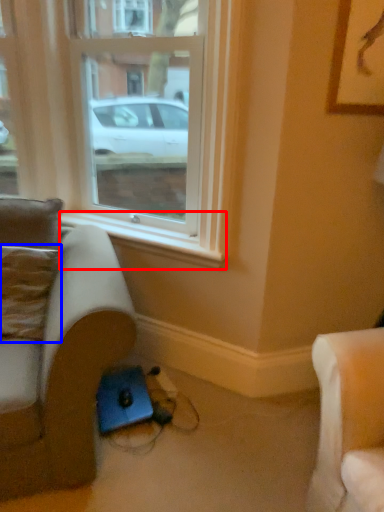
Question: Among these objects, which one is nearest to the camera, window sill (highlighted by a red box) or pillow (highlighted by a blue box)?

Choices:
 (A) window sill
 (B) pillow

Answer: (B)